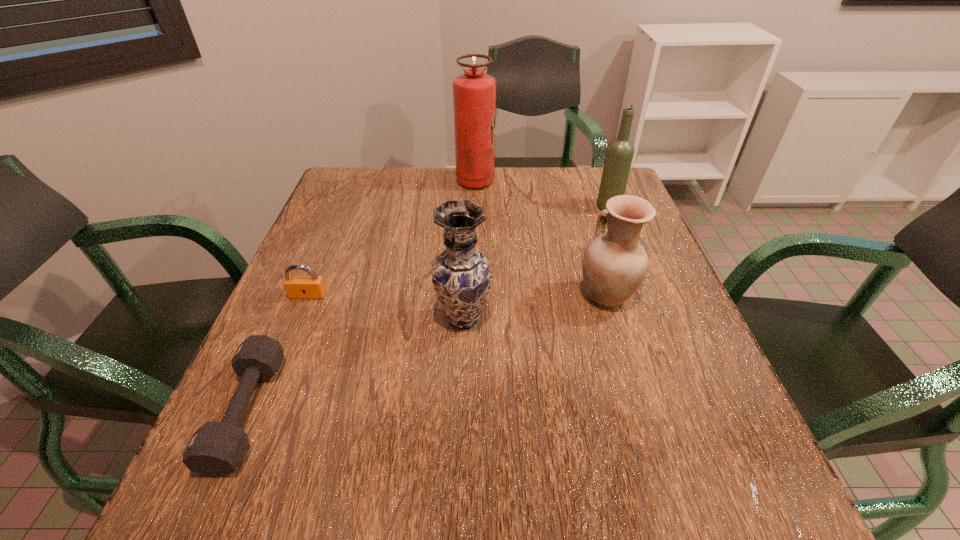
This screenshot has width=960, height=540. Find the location of `the farthest object`. the farthest object is located at coordinates (474, 93).

Find the location of a particular element. The height and width of the screenshot is (540, 960). the tallest object is located at coordinates (474, 93).

Locate an element on the screen. This screenshot has height=540, width=960. the second farthest object is located at coordinates (619, 154).

This screenshot has height=540, width=960. I want to click on vase, so 461,275.

At what (x,y) coordinates should I click in order to perform the action: click on pottery. Please return your answer as a coordinate pair (x, y). The image size is (960, 540). Looking at the image, I should click on (614, 264).

You are a GUI agent. You are given a task and a screenshot of the screen. Output one action in this format:
    pyautogui.click(x=<x>, y=<y>)
    Task: Click on the padlock
    
    Given the screenshot: What is the action you would take?
    (297, 287)

Identify the location of the shortest object. (216, 449).

Where is `dumbbell`? This screenshot has width=960, height=540. dumbbell is located at coordinates (216, 449).

Where is `vacant position located on the label side of the tallest object`? The height and width of the screenshot is (540, 960). vacant position located on the label side of the tallest object is located at coordinates (516, 181).

You are a GUI agent. You are given a task and a screenshot of the screen. Output one action in this format:
    pyautogui.click(x=<x>, y=<y>)
    Task: Click on the vacant area situated on the front of the second farthest object
    This screenshot has height=540, width=960.
    Given the screenshot: What is the action you would take?
    pyautogui.click(x=629, y=258)